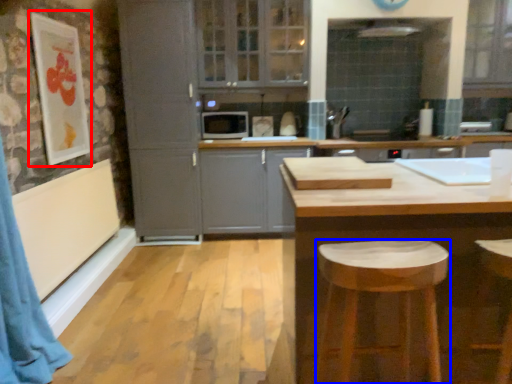
Question: Which object appears closest to the camera in this image, picture frame (highlighted by a red box) or stool (highlighted by a blue box)?

Choices:
 (A) picture frame
 (B) stool

Answer: (B)